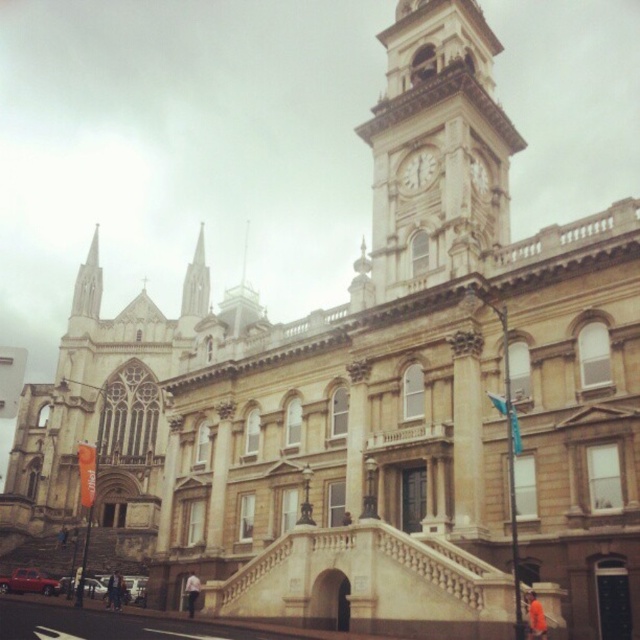
You are an architect examining the building and notice two clocks on the facade. The matte gold clock at upper center and the matte stone clock at upper center. Which one is positioned higher?

The matte gold clock at upper center is located above the matte stone clock at upper center, so it is positioned higher.

Looking at this image, you are standing in front of the grand historic building and want to know the relationship between the light brown stone clock tower at upper right and the matte gold clock at upper center. Which one is located higher?

The light brown stone clock tower at upper right is positioned over matte gold clock at upper center, so it is higher.